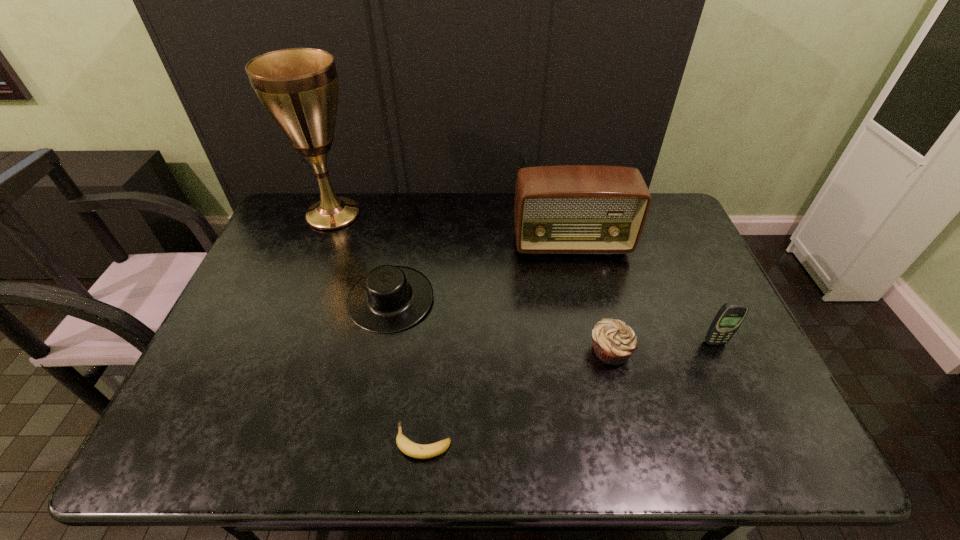
Identify the location of vacant space situated 0.390m on the front-facing side of the radio receiver. The image size is (960, 540). (598, 364).

Find the location of a particular element. The width and height of the screenshot is (960, 540). vacant space situated 0.080m on the screen of the fourth shortest object is located at coordinates pyautogui.click(x=728, y=372).

The height and width of the screenshot is (540, 960). Identify the location of vacant space located 0.320m on the right of the dress hat. (545, 300).

At what (x,y) coordinates should I click in order to perform the action: click on free location located 0.390m on the left of the muffin. Please return your answer as a coordinate pair (x, y). Looking at the image, I should click on (437, 350).

I want to click on free space located 0.310m on the back of the banana, so click(x=435, y=317).

This screenshot has width=960, height=540. What are the coordinates of `trophy cup that is at the far edge` in the screenshot? It's located at (298, 87).

Locate an element on the screen. radio receiver that is at the far edge is located at coordinates (565, 209).

Where is `object that is at the near edge`? This screenshot has width=960, height=540. object that is at the near edge is located at coordinates (414, 450).

You are a GUI agent. You are given a task and a screenshot of the screen. Output one action in this format:
    pyautogui.click(x=<x>, y=<y>)
    Task: Click on the object that is at the left edge
    The image size is (960, 540).
    Given the screenshot: What is the action you would take?
    pyautogui.click(x=298, y=87)

This screenshot has width=960, height=540. Identify the location of object at the right edge. (728, 319).